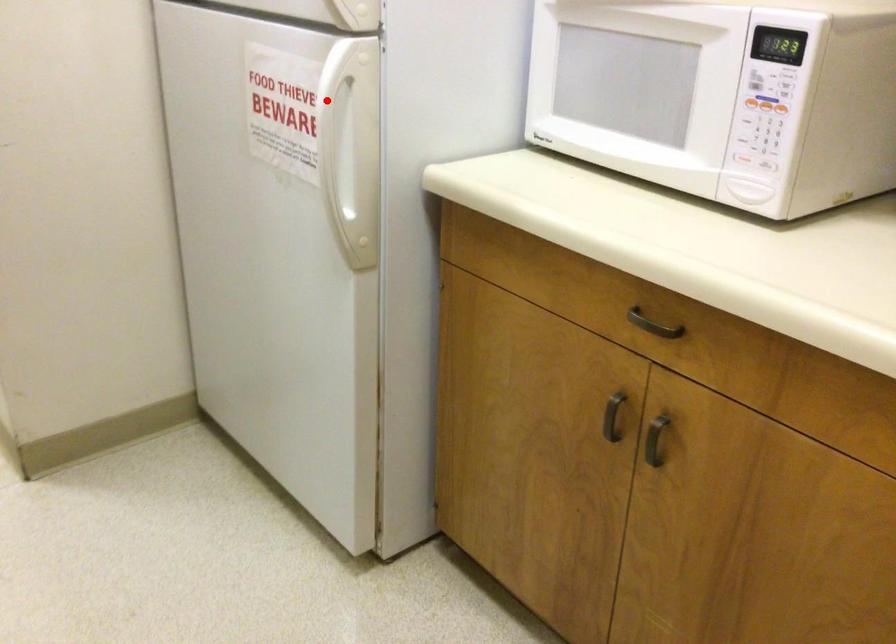
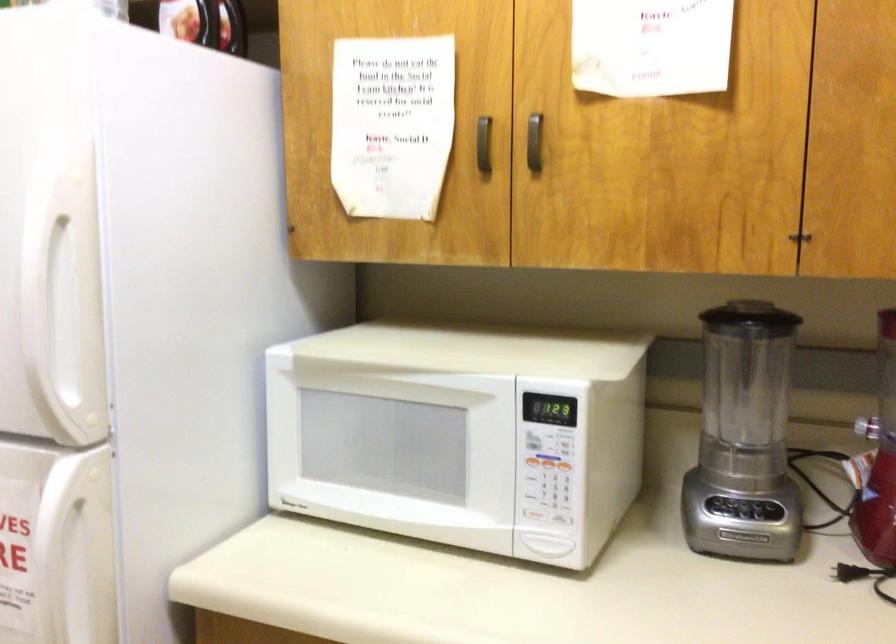
Question: I am providing you with two images of the same scene from different viewpoints. In image1, a red point is highlighted. Considering the same 3D point in image2, which of the following is correct?

Choices:
 (A) It is closer
 (B) It is farther

Answer: (A)